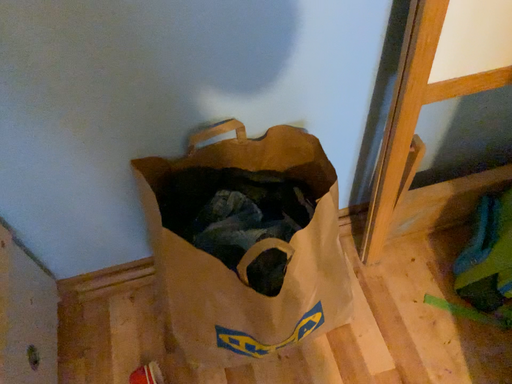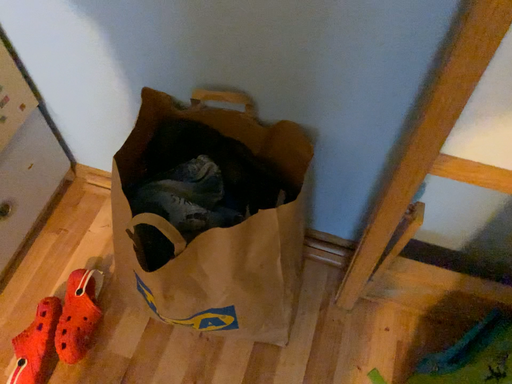
Question: How did the camera likely rotate when shooting the video?

Choices:
 (A) rotated right
 (B) rotated left

Answer: (B)